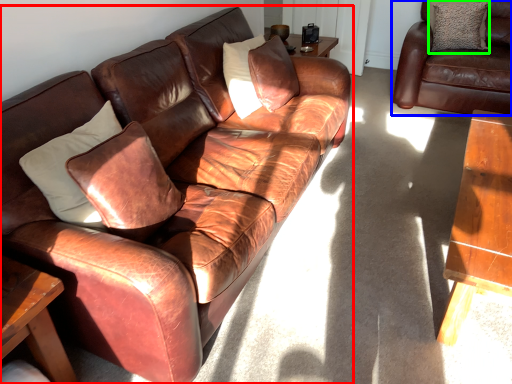
Question: Considering the real-world distances, which object is farthest from studio couch (highlighted by a red box)? studio couch (highlighted by a blue box) or pillow (highlighted by a green box)?

Choices:
 (A) studio couch
 (B) pillow

Answer: (B)